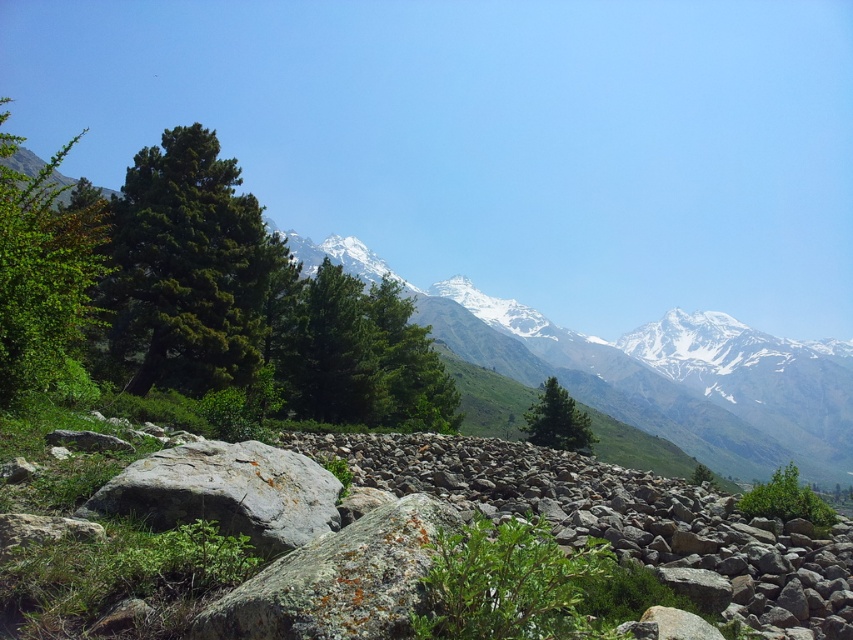
Is point (689, 404) closer to viewer compared to point (399, 310)?

That is False.

Is the position of snowy rock formation at upper center more distant than that of green leafy tree at center?

No, snowy rock formation at upper center is in front of green leafy tree at center.

Where is `snowy rock formation at upper center`? This screenshot has width=853, height=640. snowy rock formation at upper center is located at coordinates (650, 371).

Does green leafy tree at center appear under green leafy tree at lower right?

No.

Is green leafy tree at center positioned at the back of green leafy tree at lower right?

That is True.

Locate an element on the screen. green leafy tree at center is located at coordinates (408, 364).

Is green leafy tree at left positioned at the back of green leafy tree at lower right?

No, green leafy tree at left is closer to the viewer.

Does green leafy tree at left appear on the left side of green leafy tree at lower right?

Yes, green leafy tree at left is to the left of green leafy tree at lower right.

Identify the location of green leafy tree at left. (44, 276).